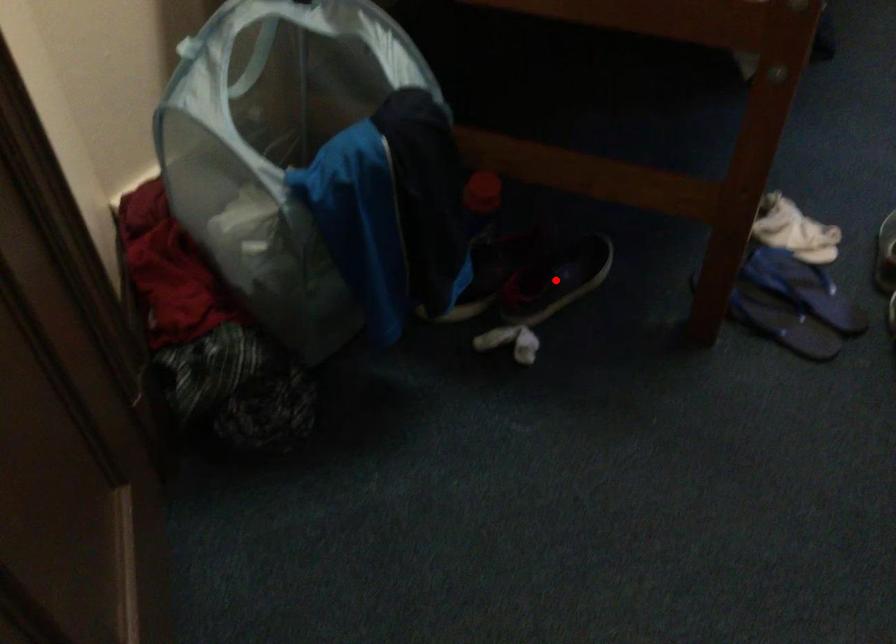
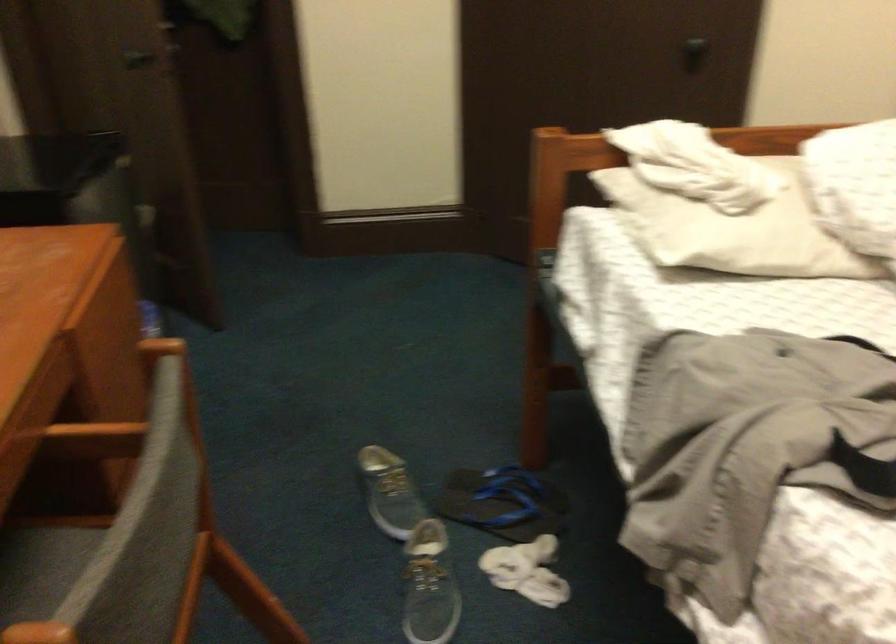
Question: I am providing you with two images of the same scene from different viewpoints. A red point is marked on the first image. Is the red point's position out of view in image 2?

Choices:
 (A) Yes
 (B) No

Answer: (A)